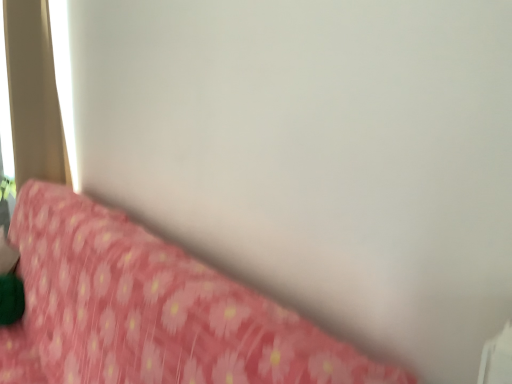
The width and height of the screenshot is (512, 384). Find the location of `pink floral fabric at lower left`. pink floral fabric at lower left is located at coordinates (150, 310).

Looking at this image, what is the approximate width of pink floral fabric at lower left?

pink floral fabric at lower left is 19.75 inches wide.

This screenshot has width=512, height=384. What do you see at coordinates (150, 310) in the screenshot?
I see `pink floral fabric at lower left` at bounding box center [150, 310].

Find the location of a particular element. Image resolution: width=512 pixels, height=384 pixels. pink floral fabric at lower left is located at coordinates (150, 310).